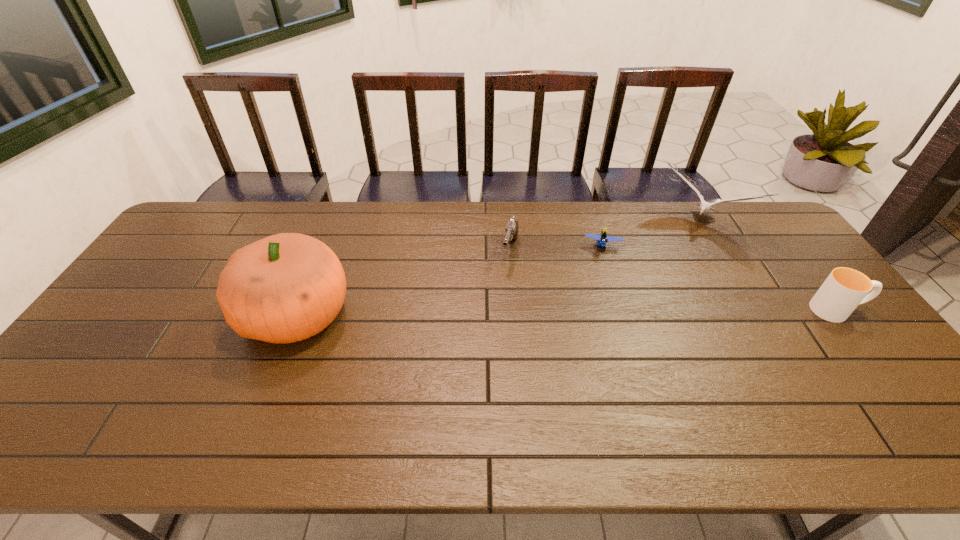
Where is `the tallest object`? This screenshot has width=960, height=540. the tallest object is located at coordinates (287, 287).

At what (x,y) coordinates should I click in order to perform the action: click on pumpkin. Please return your answer as a coordinate pair (x, y). Image resolution: width=960 pixels, height=540 pixels. Looking at the image, I should click on (287, 287).

Where is `the rightmost object`? the rightmost object is located at coordinates (844, 289).

Locate an element on the screen. This screenshot has height=540, width=960. the shortest object is located at coordinates (602, 238).

Where is `the third object from left to right`? This screenshot has height=540, width=960. the third object from left to right is located at coordinates (602, 238).

Find the location of a particular element. The width and height of the screenshot is (960, 540). the fourth object from right to left is located at coordinates (511, 230).

This screenshot has height=540, width=960. Identify the location of the fourth shortest object. (705, 207).

Locate an element on the screen. gull is located at coordinates (705, 207).

This screenshot has height=540, width=960. Find the location of `vacant region located 0.140m on the face of the tallest object`. vacant region located 0.140m on the face of the tallest object is located at coordinates point(194,314).

Image resolution: width=960 pixels, height=540 pixels. I want to click on free spot located 0.180m on the face of the tallest object, so pyautogui.click(x=180, y=314).